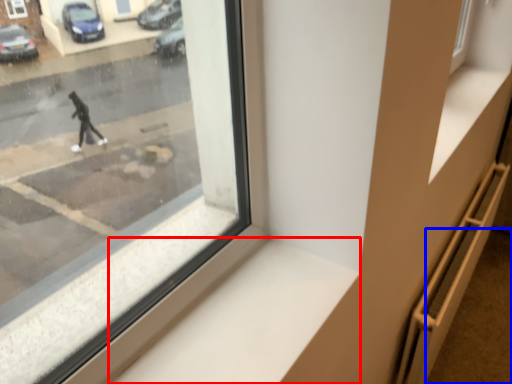
Question: Among these objects, which one is nearest to the camera, window sill (highlighted by a red box) or pavement (highlighted by a blue box)?

Choices:
 (A) window sill
 (B) pavement

Answer: (A)